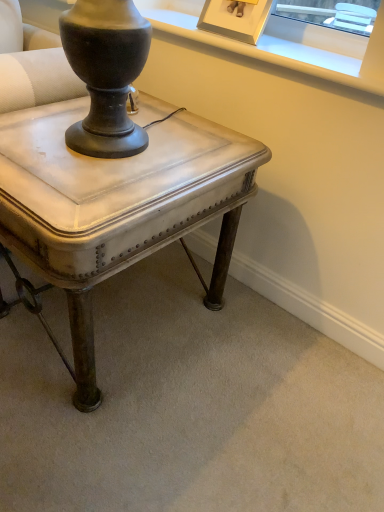
Locate an element on the screen. vacant space underneath gold-framed picture at upper center (from a real-world perspective) is located at coordinates (241, 37).